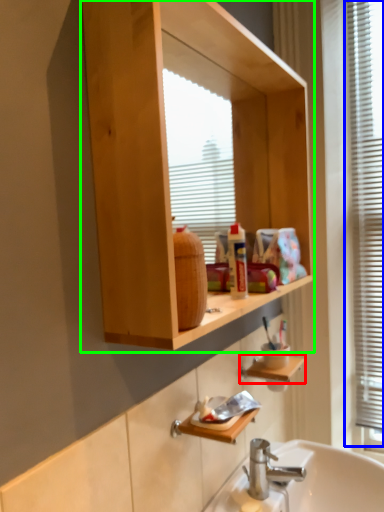
Question: Based on their relative distances, which object is farther from cabinet (highlighted by a red box)? Choose from window frame (highlighted by a blue box) and bathroom cabinet (highlighted by a green box).

Choices:
 (A) window frame
 (B) bathroom cabinet

Answer: (A)